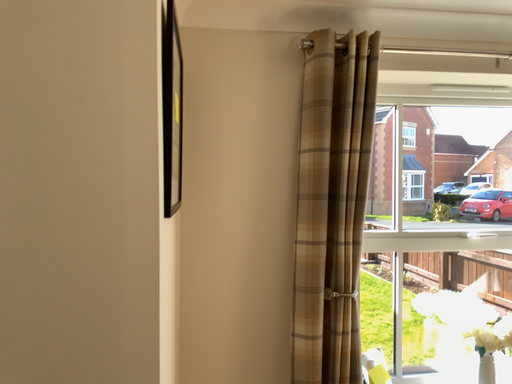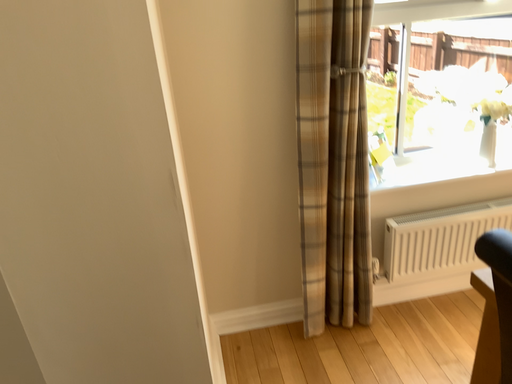
Question: How did the camera likely rotate when shooting the video?

Choices:
 (A) rotated downward
 (B) rotated upward

Answer: (A)